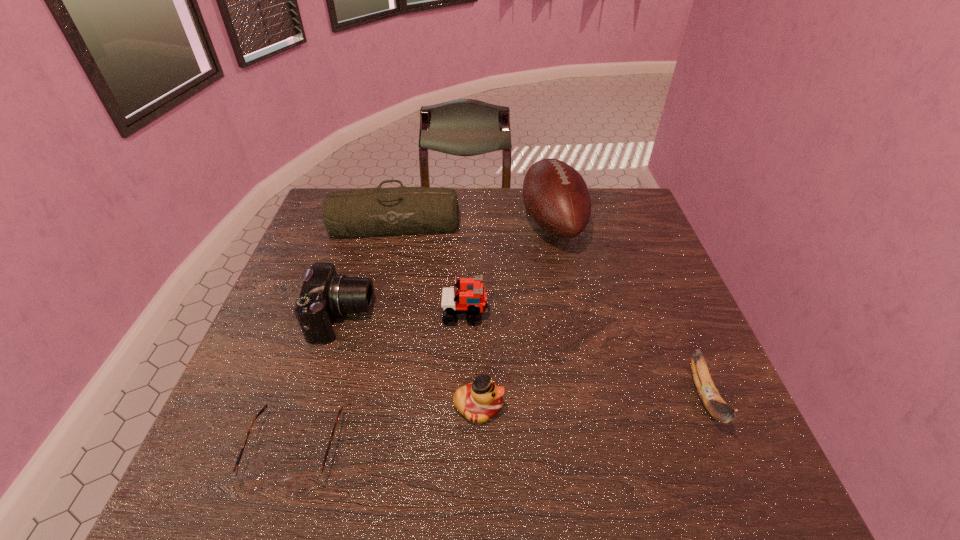
I want to click on object that can be found as the second closest to the banana, so click(481, 400).

This screenshot has width=960, height=540. I want to click on vacant space that satisfies the following two spatial constraints: 1. on the lens of the camera; 2. on the front-facing side of the spectacles, so click(x=303, y=449).

Find the location of a particular element. This screenshot has height=540, width=960. vacant region that satisfies the following two spatial constraints: 1. on the front-facing side of the Lego; 2. on the front-facing side of the shortest object is located at coordinates (461, 449).

Identify the location of vacant point that satisfies the following two spatial constraints: 1. on the front side of the football (American); 2. on the face of the duck. Image resolution: width=960 pixels, height=540 pixels. (589, 407).